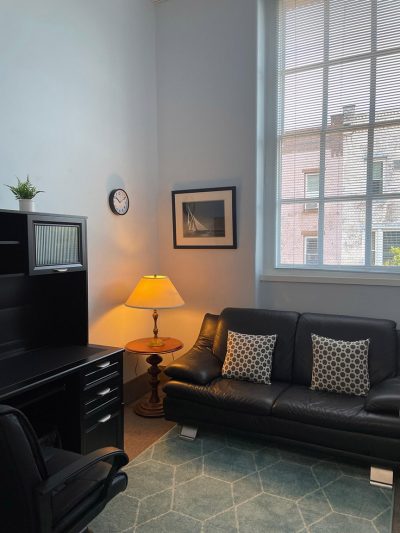
Locate an element on the screen. The height and width of the screenshot is (533, 400). lamp is located at coordinates (155, 295).